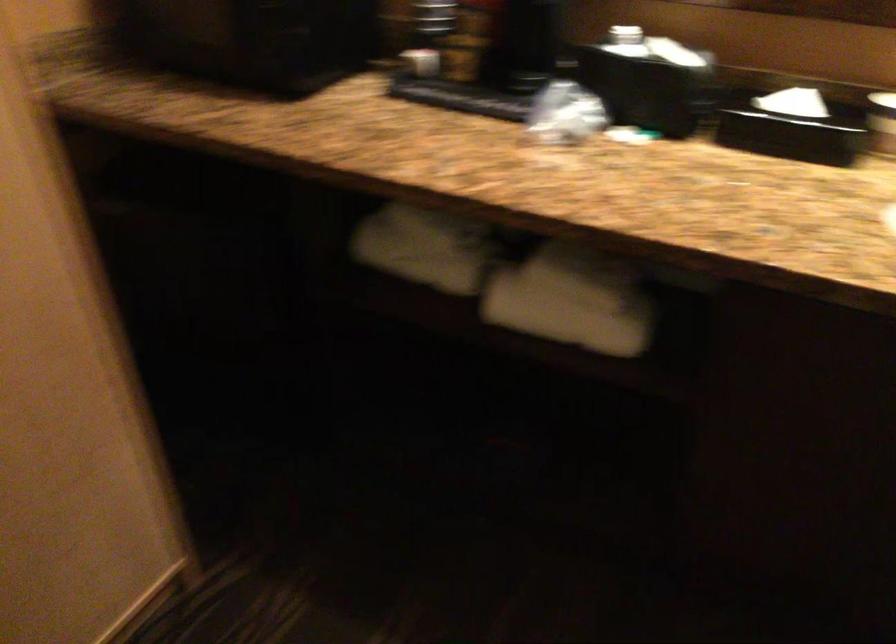
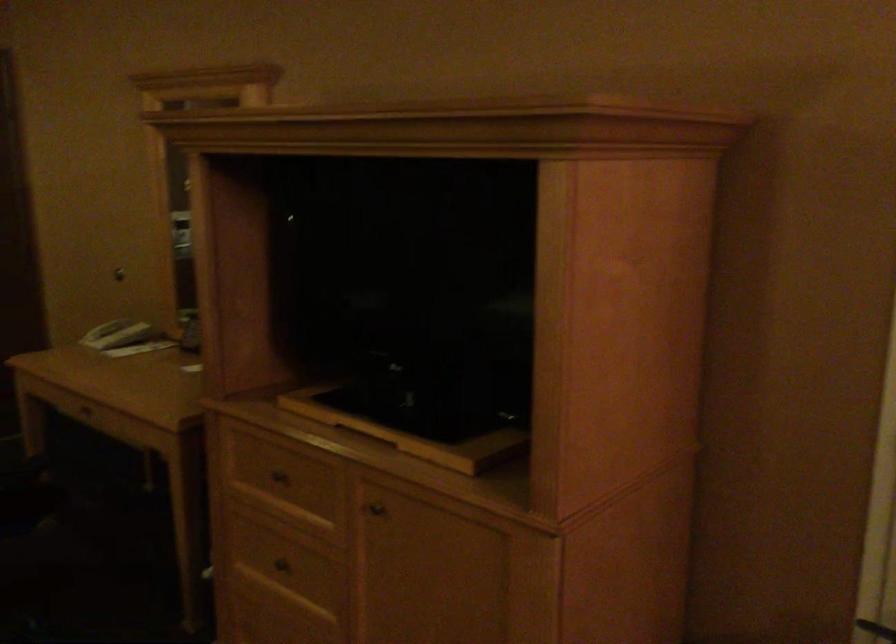
Based on the continuous images, in which direction is the camera rotating?

The camera's rotation is toward left-down.